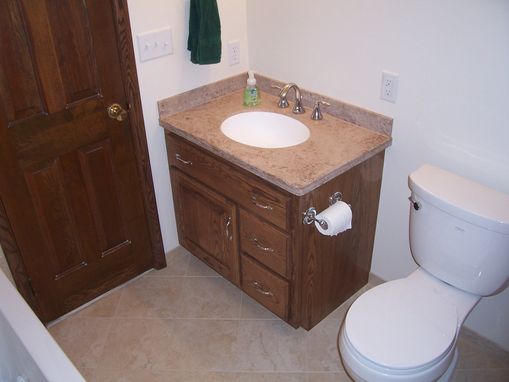
Locate an element on the screen. Image resolution: width=509 pixels, height=382 pixels. green towel is located at coordinates (207, 22).